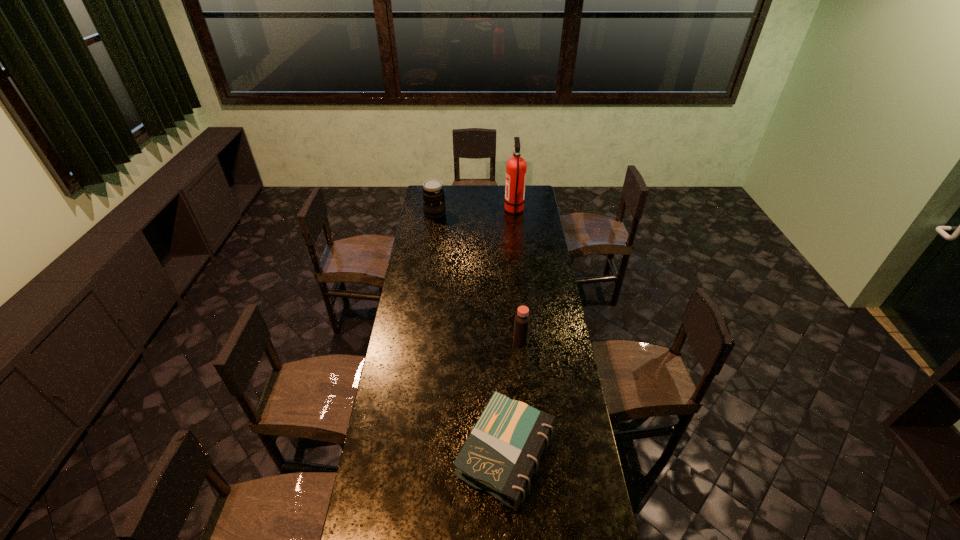
Image resolution: width=960 pixels, height=540 pixels. In order to click on the tallest object in this screenshot , I will do `click(516, 166)`.

I want to click on telephoto lens, so click(x=433, y=194).

Where is `vinegar`? The height and width of the screenshot is (540, 960). vinegar is located at coordinates (522, 319).

This screenshot has width=960, height=540. Identify the location of paperback book. (502, 452).

Where is `the nearest object`? The height and width of the screenshot is (540, 960). the nearest object is located at coordinates [x=502, y=452].

Locate an element on the screen. vacant region located 0.050m on the handle side of the fire extinguisher is located at coordinates (496, 211).

This screenshot has height=540, width=960. What are the coordinates of `vacant region located 0.360m on the handle side of the fire extinguisher` in the screenshot? It's located at (447, 211).

In order to click on free point located 0.180m on the handle side of the fire extinguisher in this screenshot , I will do `click(475, 211)`.

This screenshot has height=540, width=960. What are the coordinates of `vacant space located on the back of the leftmost object` in the screenshot? It's located at (438, 191).

Locate an element on the screen. This screenshot has height=540, width=960. blank space located 0.360m on the back of the second nearest object is located at coordinates (516, 282).